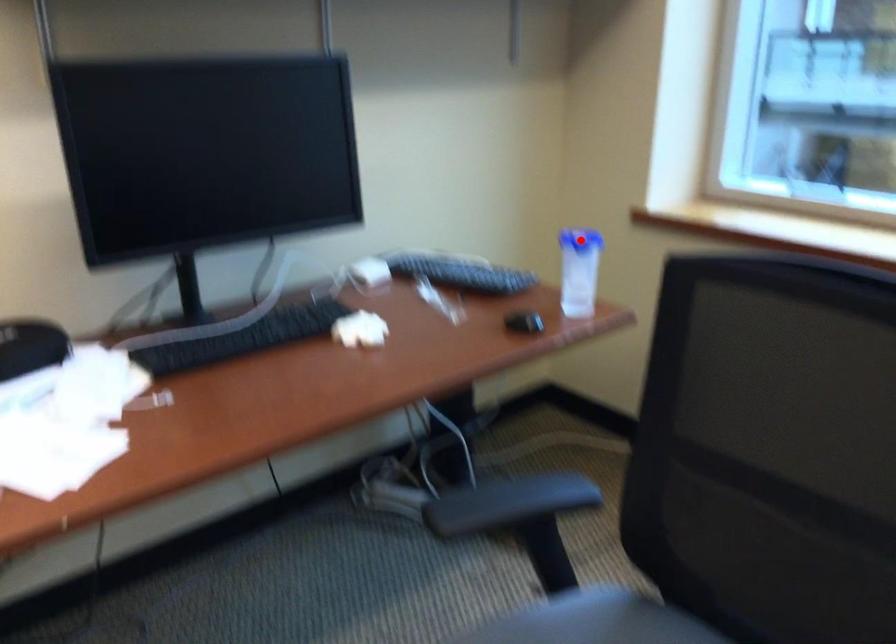
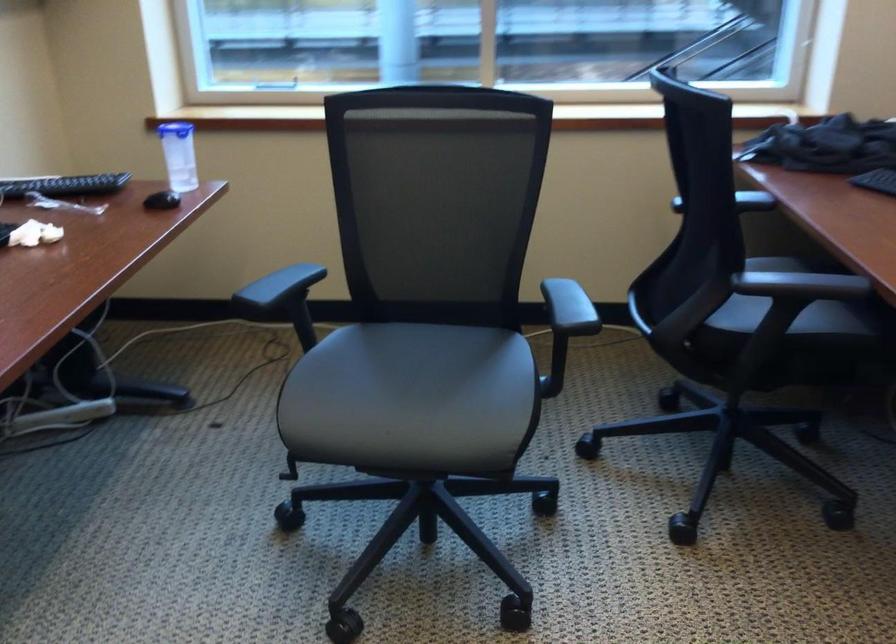
Question: I am providing you with two images of the same scene from different viewpoints. A red point is marked on the first image. At the location where the point appears in image 1, is it still visible in image 2?

Choices:
 (A) Yes
 (B) No

Answer: (B)